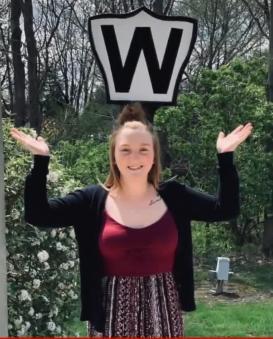
Find the location of `stand`. stand is located at coordinates (149, 96).